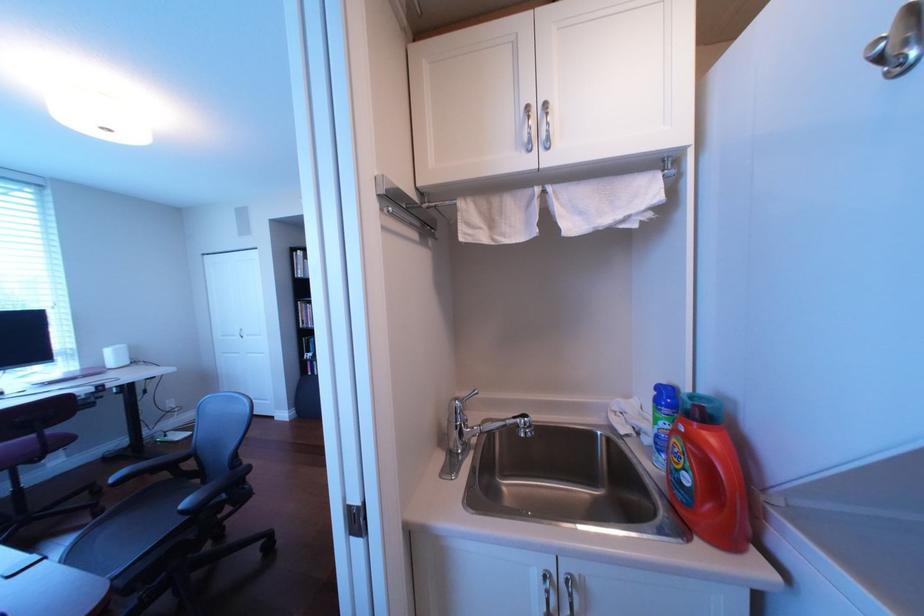
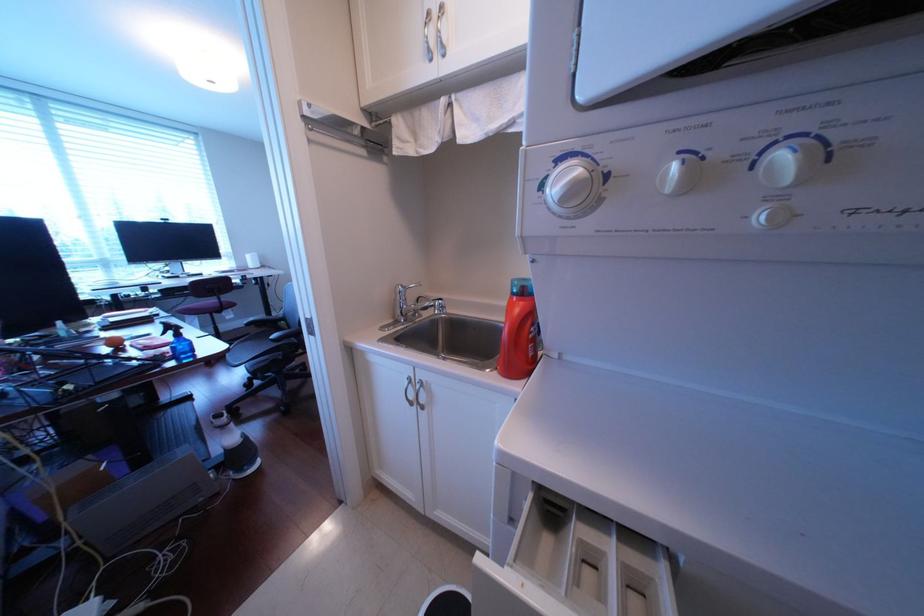
Question: Which direction would the cameraman need to move to produce the second image? Reply with the corresponding letter.

Choices:
 (A) Left
 (B) Right
 (C) Forward
 (D) Backward

Answer: (B)